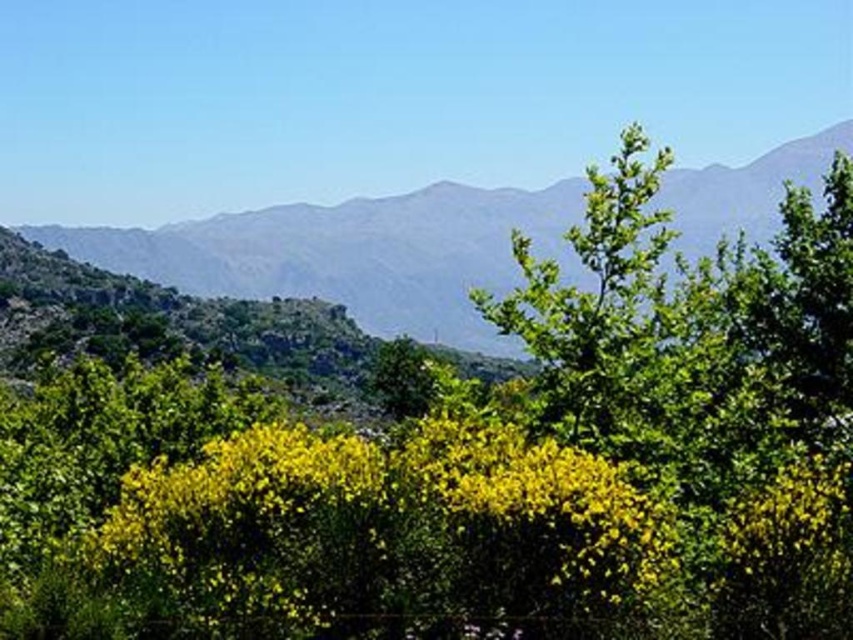
Which of these two, green textured mountain at center or green leafy tree at center, stands taller?

green textured mountain at center

Who is more forward, (561,205) or (643,138)?

Point (643,138) is in front.

Image resolution: width=853 pixels, height=640 pixels. I want to click on green textured mountain at center, so click(354, 253).